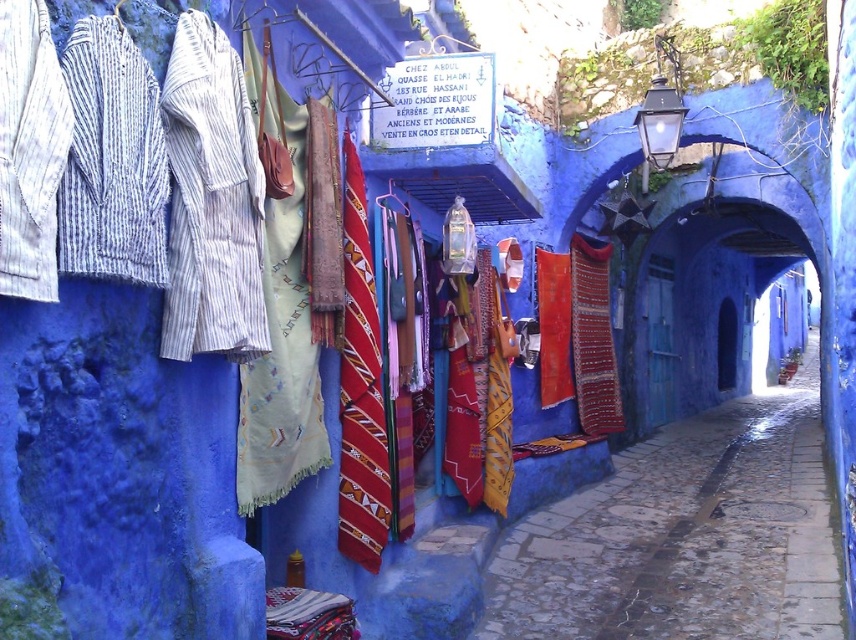
In the scene shown: You are a traveler carrying a heavy backpack and want to place your matte fabric bag at center on the ground. Will the smooth cobblestone alley at center provide a stable surface for the bag?

The smooth cobblestone alley at center is positioned under the matte fabric bag at center, so yes, the smooth cobblestone alley at center can provide a stable surface for the matte fabric bag at center since it is directly underneath it.

You are a traveler who wants to buy a souvenir that can be easily carried in a bag. You see the red woven fabric tie at center and the matte fabric bag at center. Based on their sizes, which one would you choose to carry the other?

The red woven fabric tie at center is wider than the matte fabric bag at center, so the red woven fabric tie at center can carry the matte fabric bag at center.